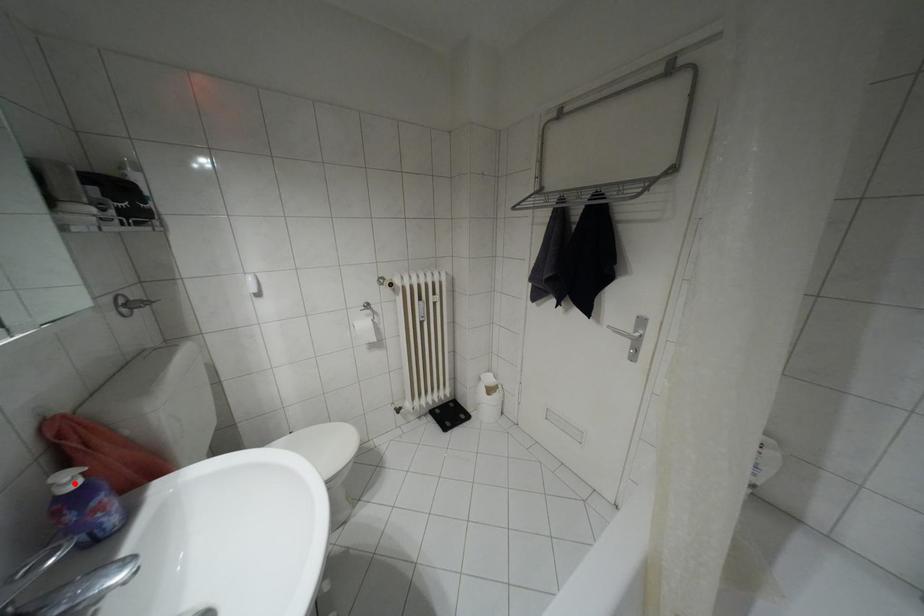
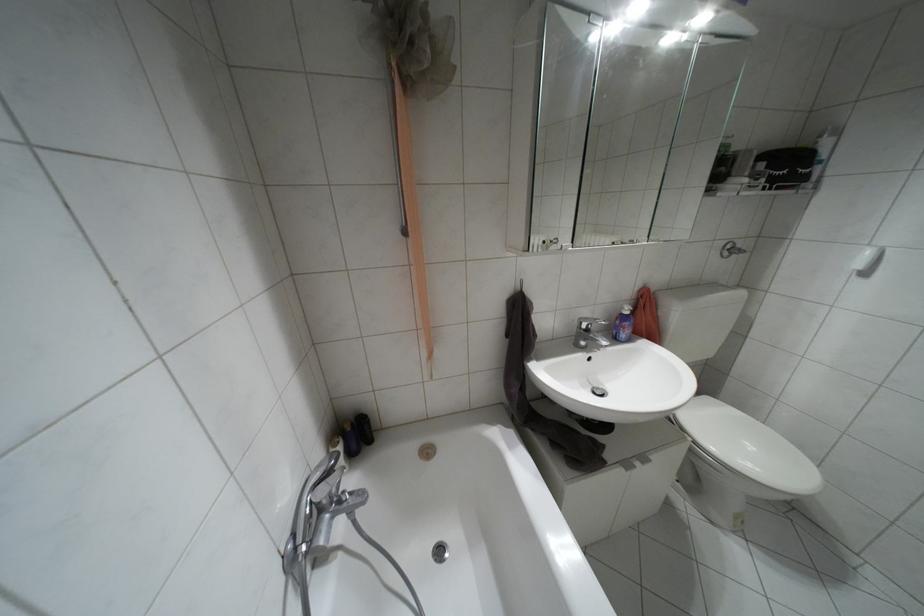
Where in the second image is the point corresponding to the highlighted location from the first image?

(626, 312)